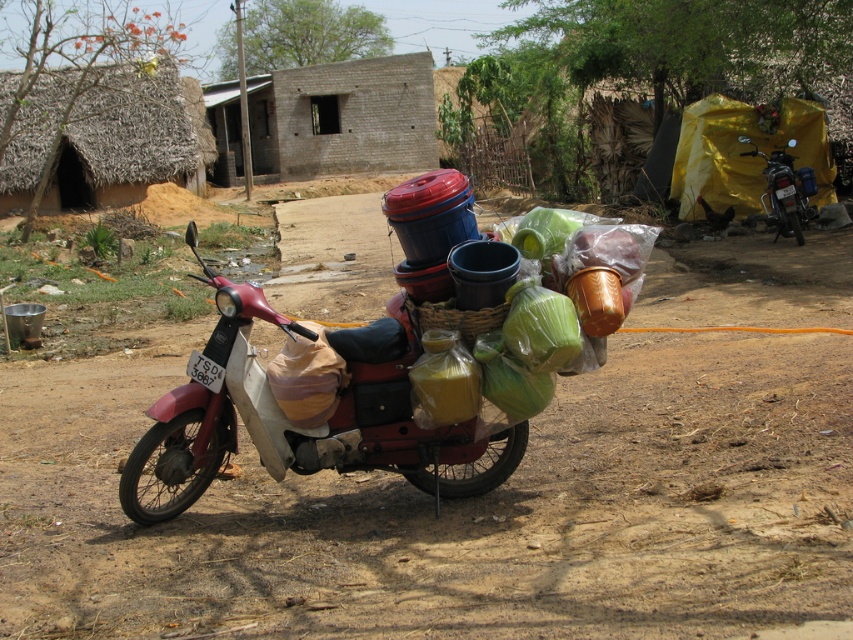
What do you see at coordinates (291, 422) in the screenshot?
I see `metallic red scooter at center` at bounding box center [291, 422].

Which is behind, point (219, 305) or point (795, 230)?

Positioned behind is point (795, 230).

The width and height of the screenshot is (853, 640). I want to click on metallic red scooter at center, so click(x=291, y=422).